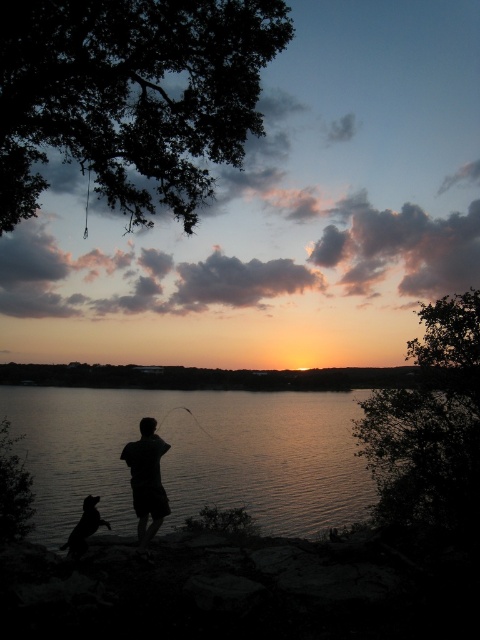
You are a photographer trying to capture the sunset scene. You want to position yourself so that the silhouette fur dog at lower left is on the left side of your photo and the silvery reflective water at center is on the right side. Is this possible based on their current positions?

Yes, because the silvery reflective water at center is already positioned to the right of the silhouette fur dog at lower left, so arranging them in the photo with the dog on the left and water on the right aligns with their current spatial arrangement.

You are a photographer planning to capture the sunset scene. You want to ensure that the silvery reflective water at center and the black matte fisherman at center are both clearly visible in your photo. Considering their sizes, which object might require you to adjust your camera settings to avoid overexposure?

The silvery reflective water at center is larger in size than the black matte fisherman at center, so the silvery reflective water at center might require adjusting camera settings to avoid overexposure due to its larger reflective surface.